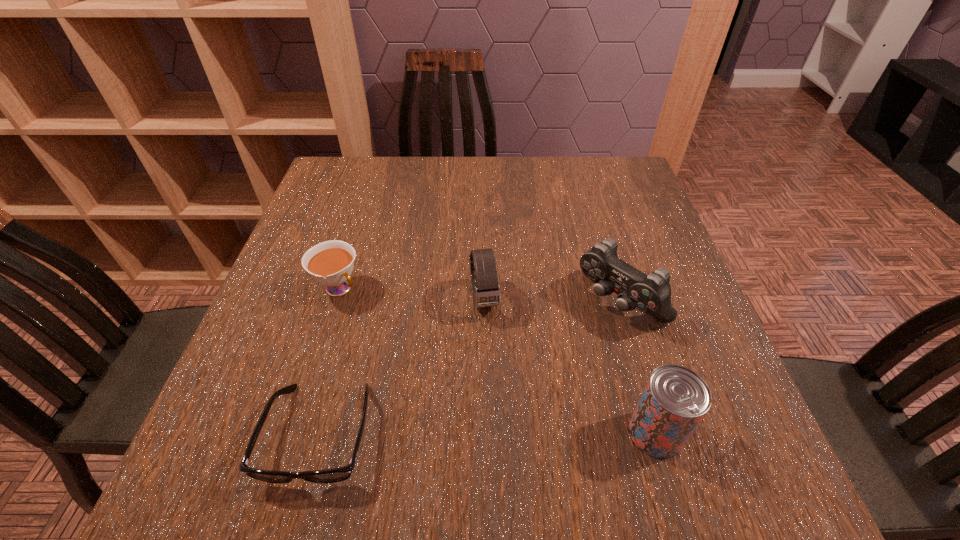
Where is `object that can be found as the fourth closest to the beer can`? This screenshot has height=540, width=960. object that can be found as the fourth closest to the beer can is located at coordinates (331, 263).